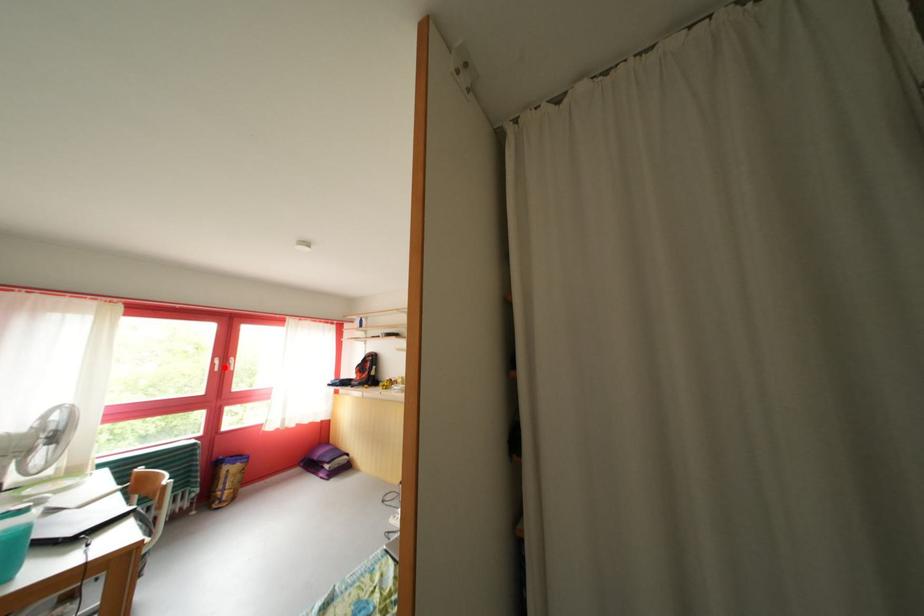
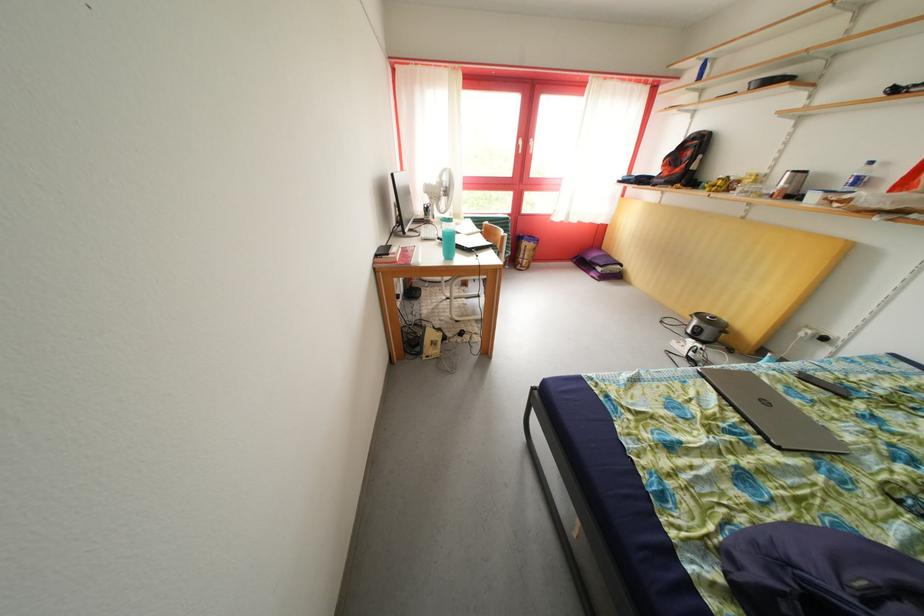
Question: I am providing you with two images of the same scene from different viewpoints. A red point is shown in image1. For the corresponding object point in image2, is it positioned nearer or farther from the camera?

Choices:
 (A) Nearer
 (B) Farther

Answer: (A)